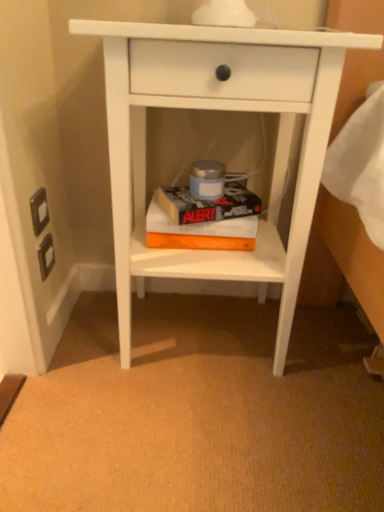
Question: Based on their sizes in the image, would you say white matte nightstand at center is bigger or smaller than hardcover book at center, the 2th paperback book ordered from the bottom?

Choices:
 (A) big
 (B) small

Answer: (A)

Question: From the image's perspective, is white matte nightstand at center positioned above or below hardcover book at center, which is the 1th paperback book from top to bottom?

Choices:
 (A) above
 (B) below

Answer: (B)

Question: Which object is positioned closest to the white matte nightstand at center?

Choices:
 (A) hardcover book at center, which is the 1th paperback book from top to bottom
 (B) orange matte paperback book at center, which is the 2th paperback book from top to bottom

Answer: (B)

Question: Based on their relative distances, which object is farther from the hardcover book at center, which is the 1th paperback book from top to bottom?

Choices:
 (A) orange matte paperback book at center, which is the 2th paperback book from top to bottom
 (B) white matte nightstand at center

Answer: (B)